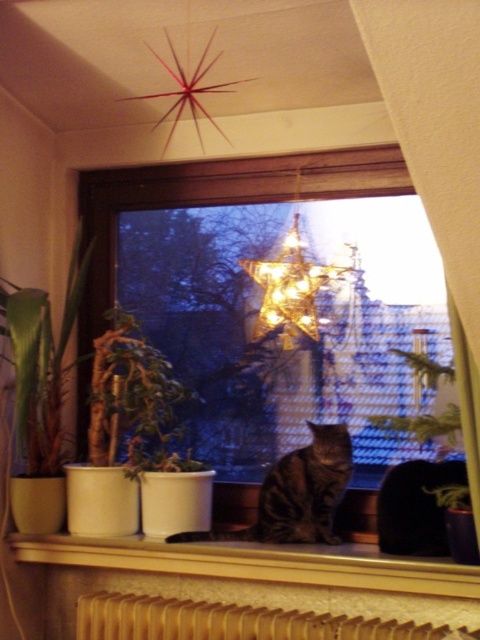
You are an interior designer arranging items on a window sill. You have a metallic star at center and a green matte plant at left. Which object is placed higher relative to the other?

The metallic star at center is positioned over the green matte plant at left, so it is placed higher.

You are standing in the room and notice both the metallic star at center and the green matte plant at left. Which object is closer to you?

The metallic star at center is closer to you because it is in front of the green matte plant at left.

You are a delivery robot that needs to place a small package on the white ceramic window sill at center. The robot has a camera that can detect objects in the scene using coordinates. The window sill is marked by point (257, 563). If the robot moves forward 0.1 units in the x direction, will it still be aligned with the white ceramic window sill at center?

The white ceramic window sill at center is represented by point (257, 563). Moving forward 0.1 units in the x direction would take the robot to 0.980, 0.537, which is beyond the window sill, so it would no longer be aligned.